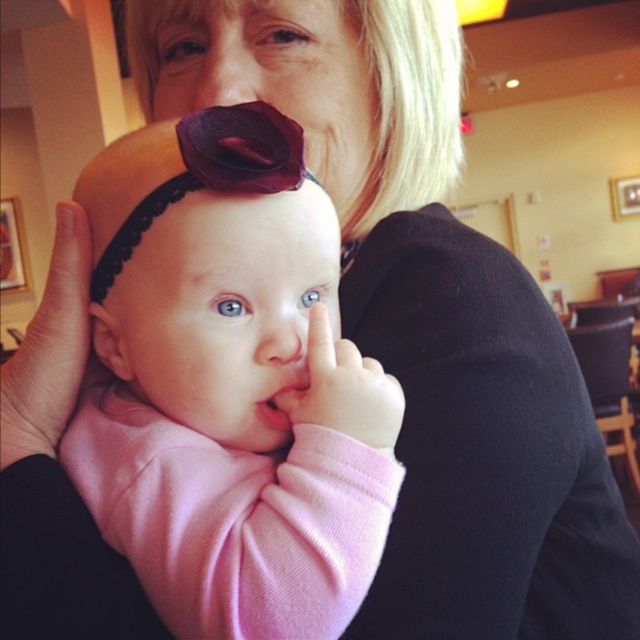
You are standing in a room and see two points marked in the image. The first point is at coordinate point (392,497) and the second is at point (148,628). Which point is closer to you?

Point (392,497) is closer to the viewer than point (148,628).

You are a photographer setting up for a baby photoshoot. You notice the pink satin headband at center and the pink fabric at center in the scene. Which object is located to the right when viewed from the camera angle?

The pink satin headband at center is positioned on the right side of the pink fabric at center, so it is located to the right when viewed from the camera angle.

You are a photographer taking a portrait of the adult and baby. You need to ensure that both the matte purple flower at center and the smooth skin nose at center are in focus. Which object should you adjust your camera focus to prioritize to ensure both are sharp?

The matte purple flower at center is above the smooth skin nose at center. To ensure both are in focus, prioritize focusing on the matte purple flower at center since it is farther away, as depth of field will include the closer nose in the sharp range.